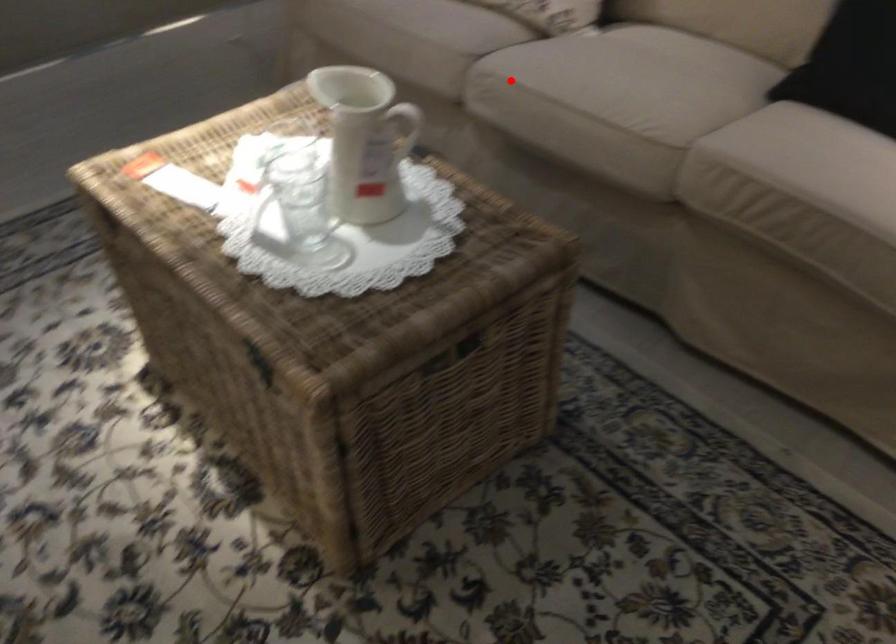
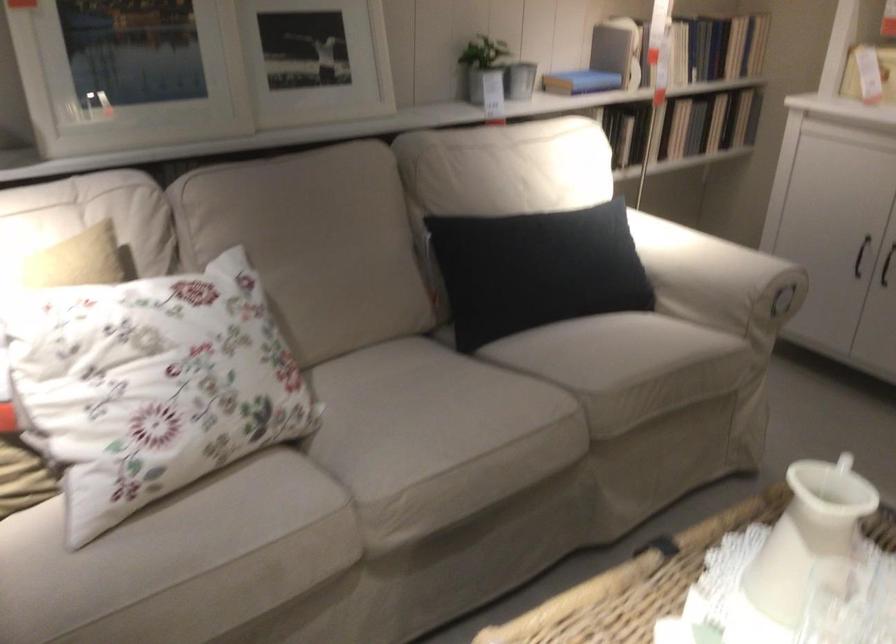
Question: I am providing you with two images of the same scene from different viewpoints. In image1, a red point is highlighted. Considering the same 3D point in image2, which of the following is correct?

Choices:
 (A) It is closer
 (B) It is farther

Answer: (A)